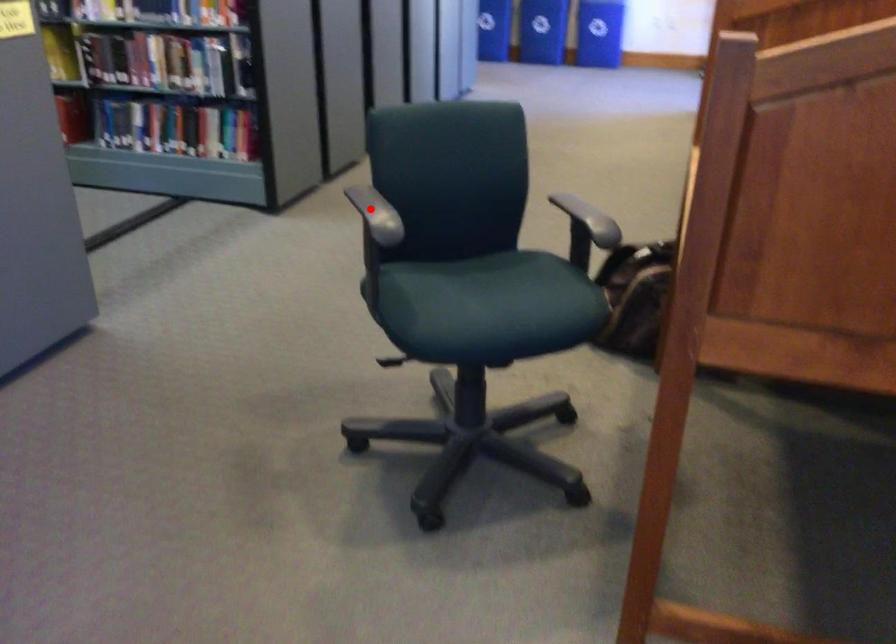
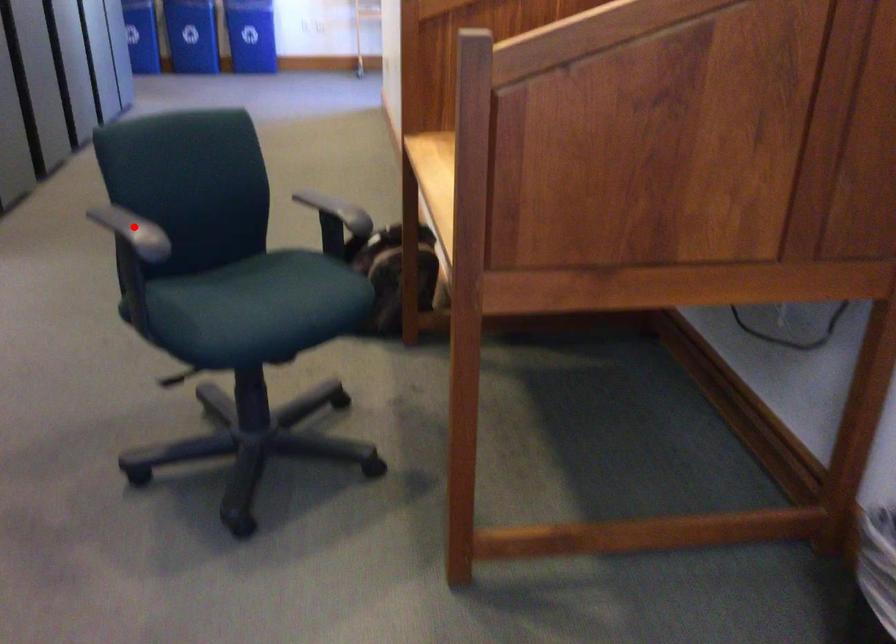
I am providing you with two images of the same scene from different viewpoints. A red point is marked on the first image and another point is marked on the second image. Is the red point in image1 aligned with the point shown in image2?

Yes